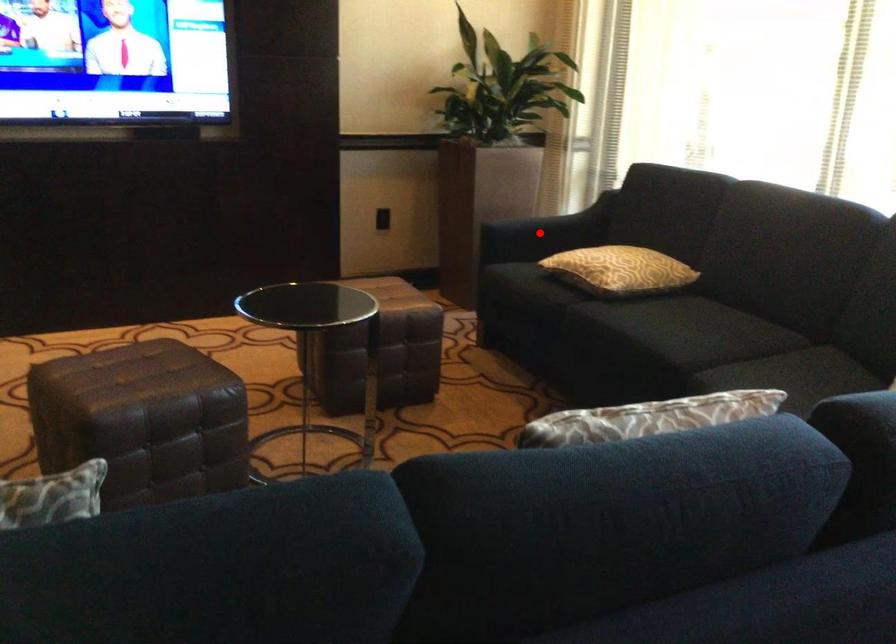
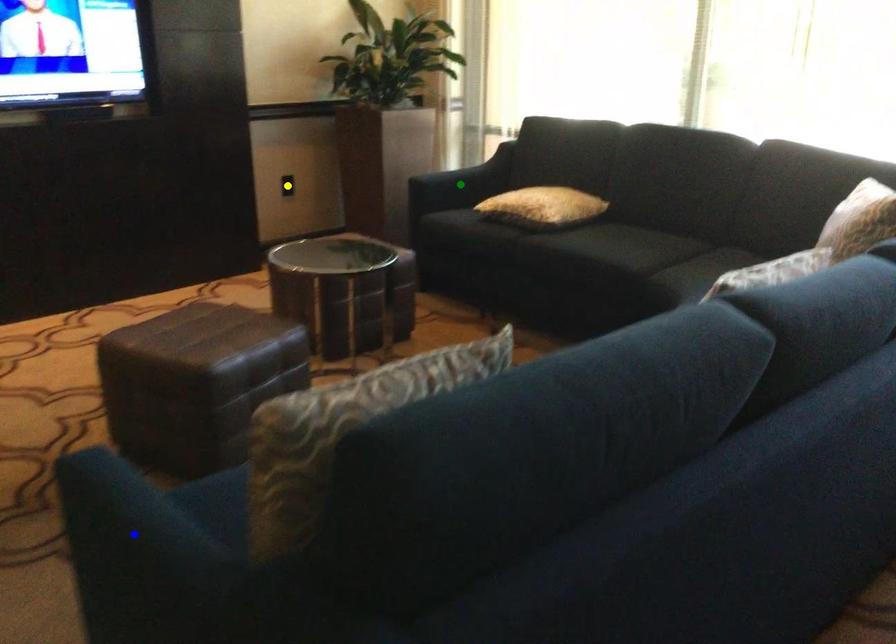
Question: I am providing you with two images of the same scene from different viewpoints. A red point is marked on the first image. You are given multiple points on the second image. Which mark in image 2 goes with the point in image 1?

Choices:
 (A) blue point
 (B) green point
 (C) yellow point

Answer: (B)